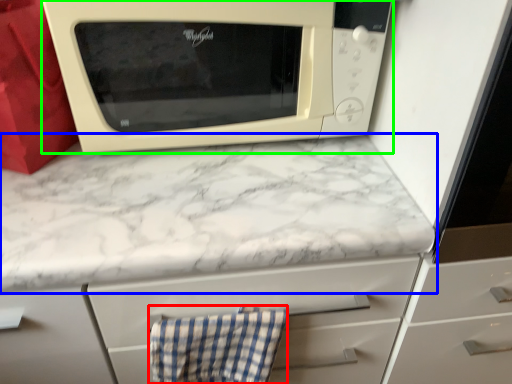
Question: Which object is the closest to the hand towel (highlighted by a red box)? Choose among these: countertop (highlighted by a blue box) or microwave oven (highlighted by a green box).

Choices:
 (A) countertop
 (B) microwave oven

Answer: (A)